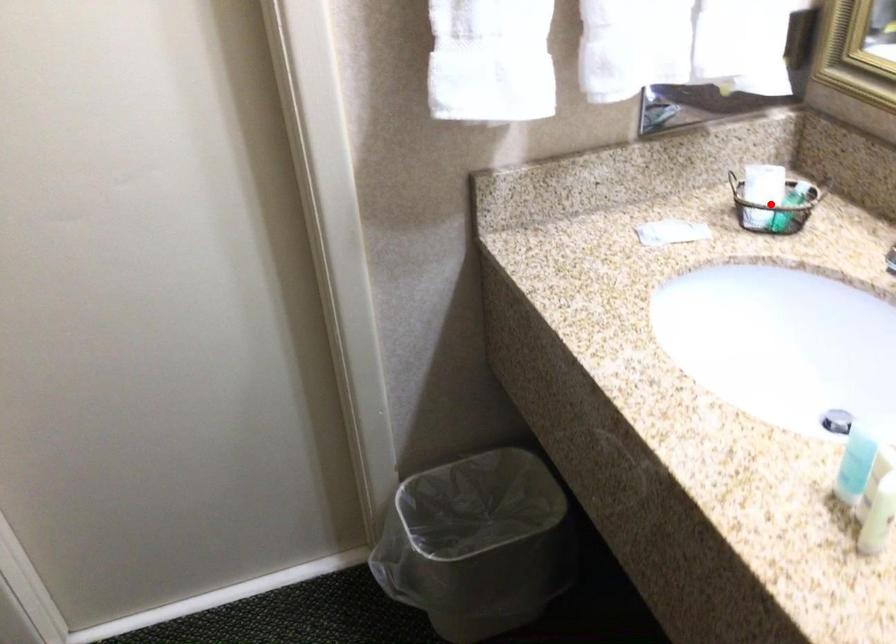
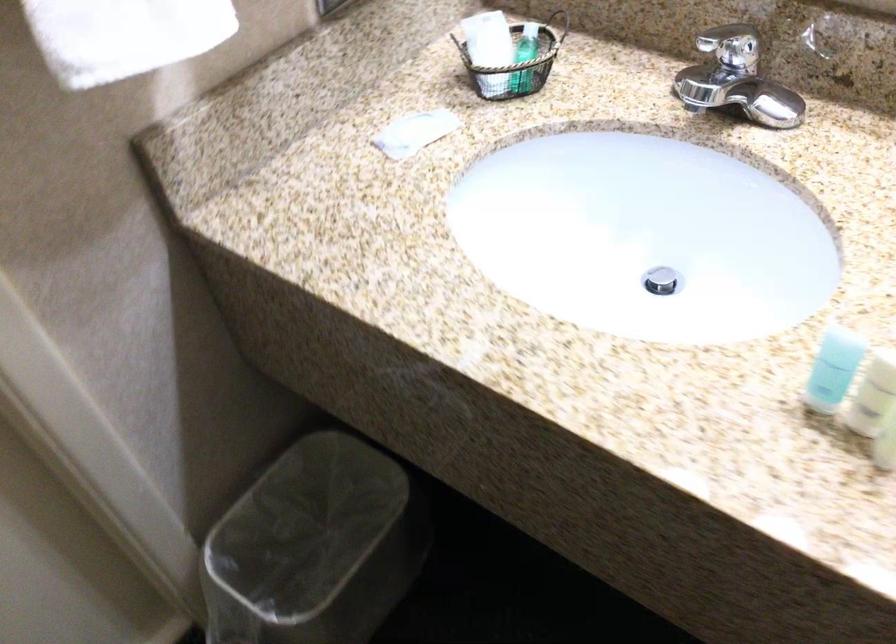
Question: I am providing you with two images of the same scene from different viewpoints. In image1, a red point is highlighted. Considering the same 3D point in image2, which of the following is correct?

Choices:
 (A) It is closer
 (B) It is farther

Answer: (A)